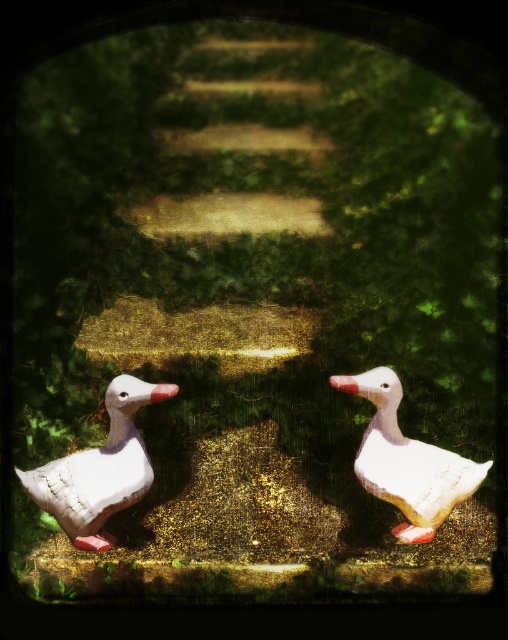
Question: Is white matte duck at lower left closer to camera compared to white matte duck at center?

Choices:
 (A) no
 (B) yes

Answer: (B)

Question: Does white matte duck at lower left have a greater width compared to white matte duck at center?

Choices:
 (A) yes
 (B) no

Answer: (B)

Question: Is white matte duck at lower left below white matte duck at center?

Choices:
 (A) yes
 (B) no

Answer: (A)

Question: Among these objects, which one is nearest to the camera?

Choices:
 (A) white matte duck at lower left
 (B) white matte duck at center

Answer: (A)